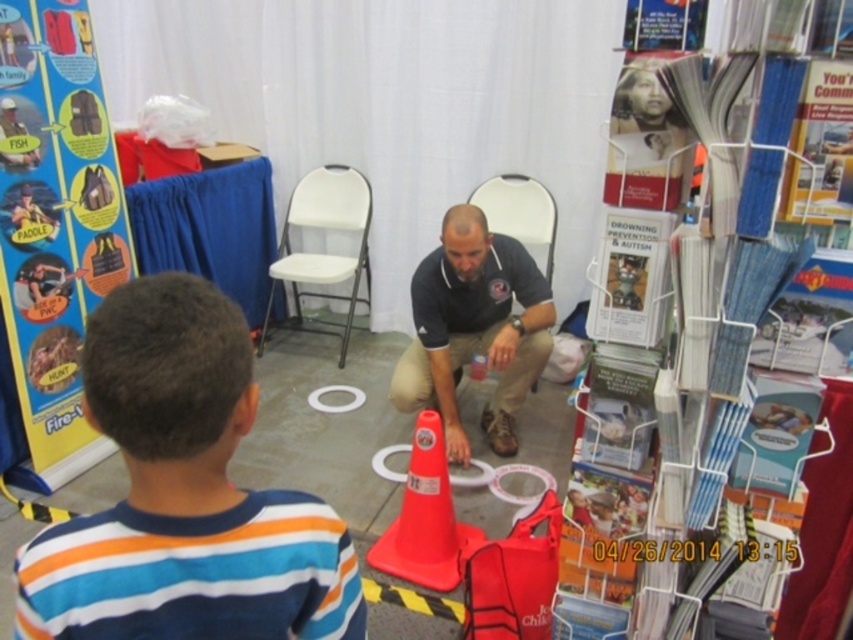
The image size is (853, 640). Identify the location of striped cotton shirt at lower left. pyautogui.click(x=184, y=493).

Does striped cotton shirt at lower left appear under matte black shirt at center?

Indeed, striped cotton shirt at lower left is positioned under matte black shirt at center.

What do you see at coordinates (184, 493) in the screenshot?
I see `striped cotton shirt at lower left` at bounding box center [184, 493].

At what (x,y) coordinates should I click in order to perform the action: click on striped cotton shirt at lower left. Please return your answer as a coordinate pair (x, y). This screenshot has width=853, height=640. Looking at the image, I should click on (184, 493).

Between point (546, 308) and point (343, 339), which one is positioned in front?

Positioned in front is point (546, 308).

Can you confirm if matte black shirt at center is positioned above white plastic chair at center?

Incorrect, matte black shirt at center is not positioned above white plastic chair at center.

Find the location of a particular element. The image size is (853, 640). matte black shirt at center is located at coordinates (474, 328).

Who is positioned more to the right, striped cotton shirt at lower left or white plastic chair at center?

Positioned to the right is striped cotton shirt at lower left.

Which of these two, striped cotton shirt at lower left or white plastic chair at center, stands taller?

white plastic chair at center

Where is `striped cotton shirt at lower left`? Image resolution: width=853 pixels, height=640 pixels. striped cotton shirt at lower left is located at coordinates (184, 493).